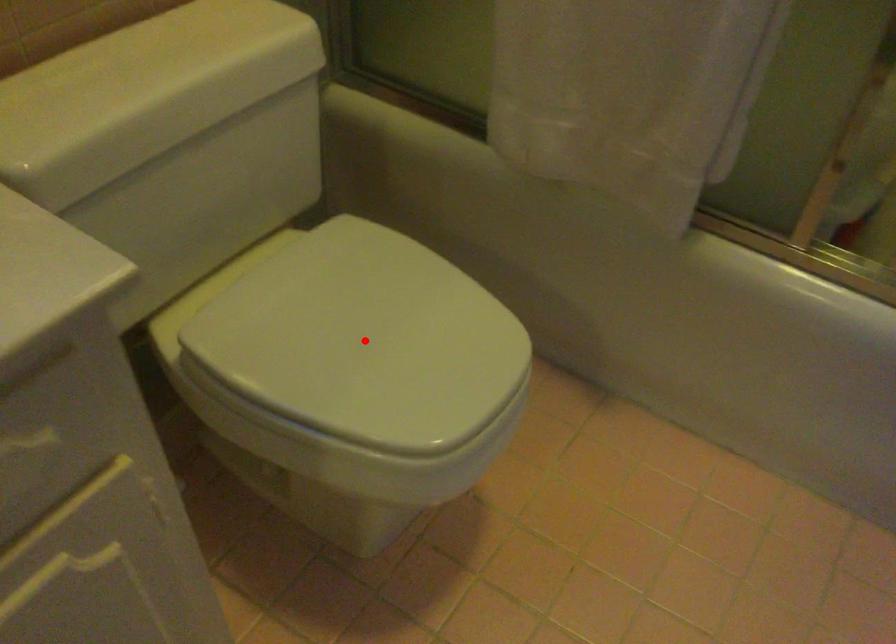
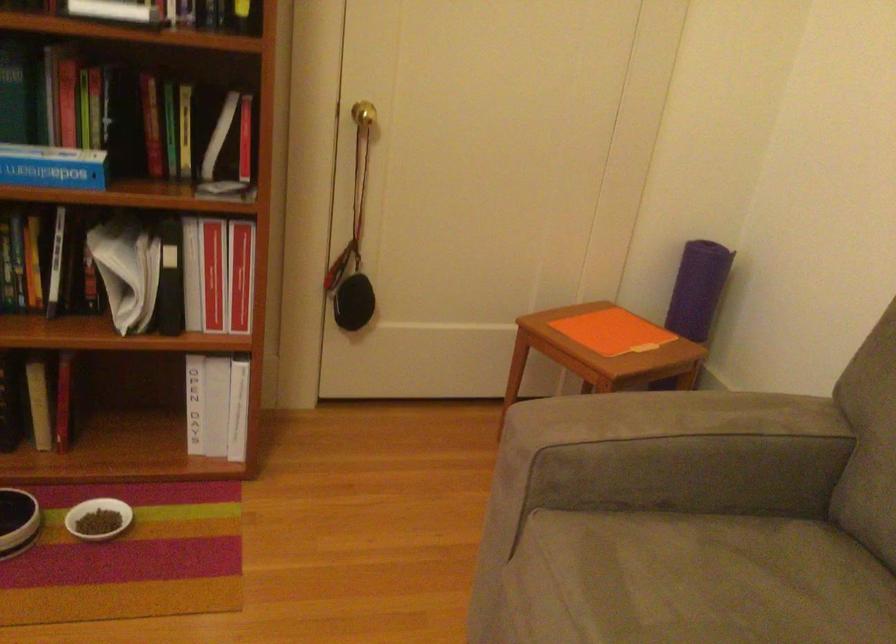
Question: I am providing you with two images of the same scene from different viewpoints. A red point is marked on the first image. Can you still see the location of the red point in image 2?

Choices:
 (A) Yes
 (B) No

Answer: (B)